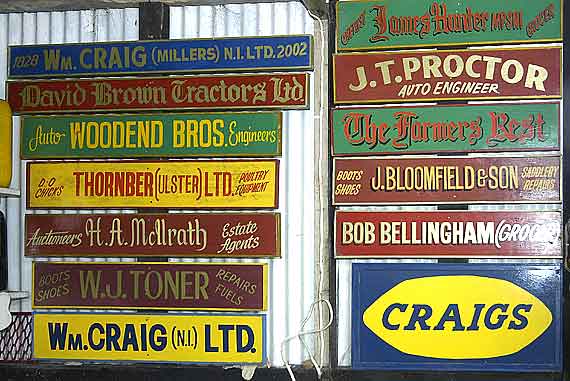
The height and width of the screenshot is (381, 570). I want to click on electrical wire, so click(x=320, y=244).